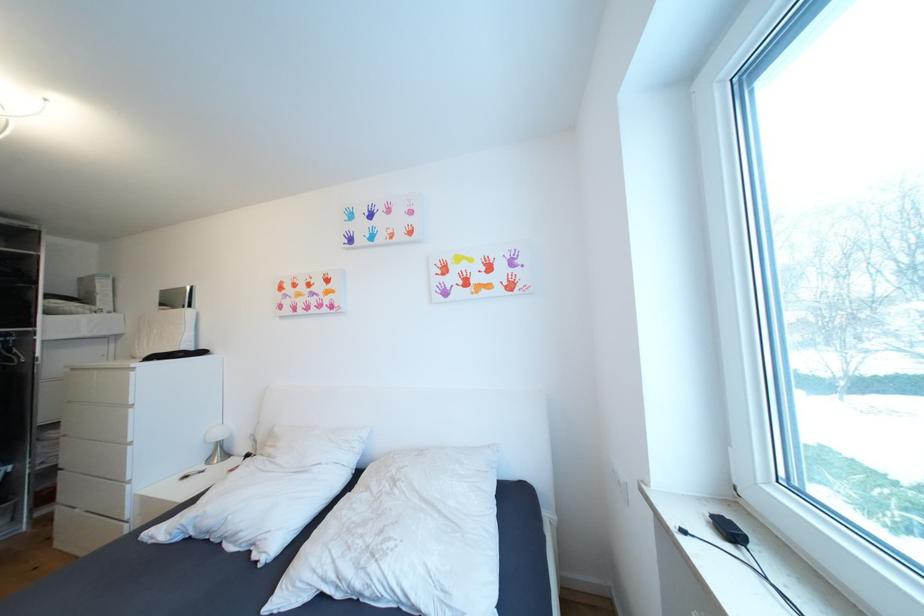
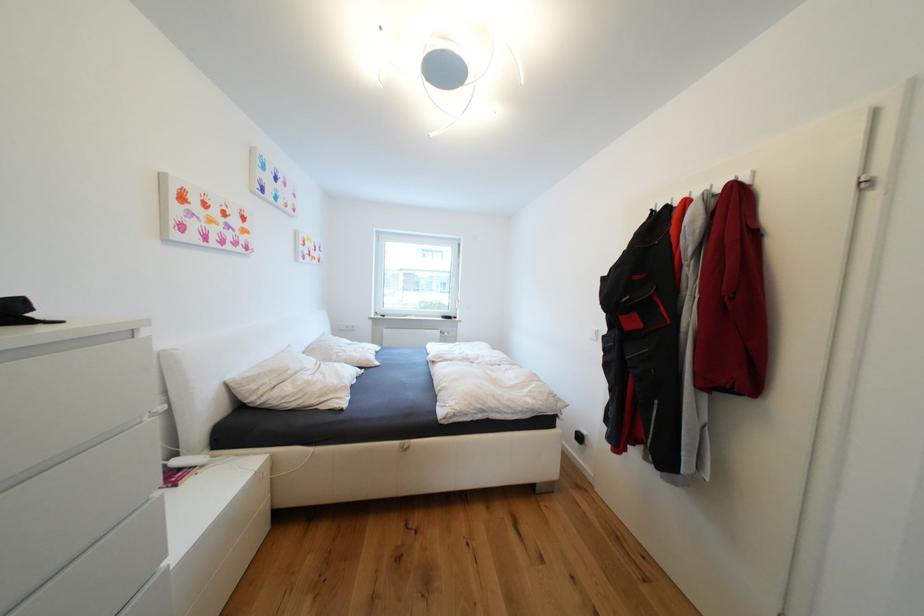
Question: I am providing you with two images of the same scene from different viewpoints. After the viewpoint changes to image2, which objects are now occluded?

Choices:
 (A) white pillow
 (B) white remote control
 (C) white light switch
 (D) none of these

Answer: (D)